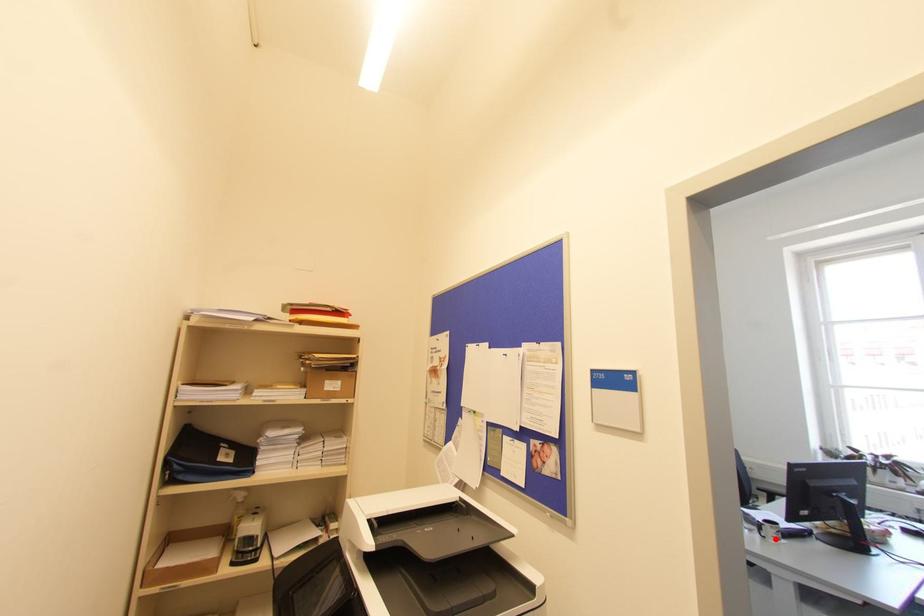
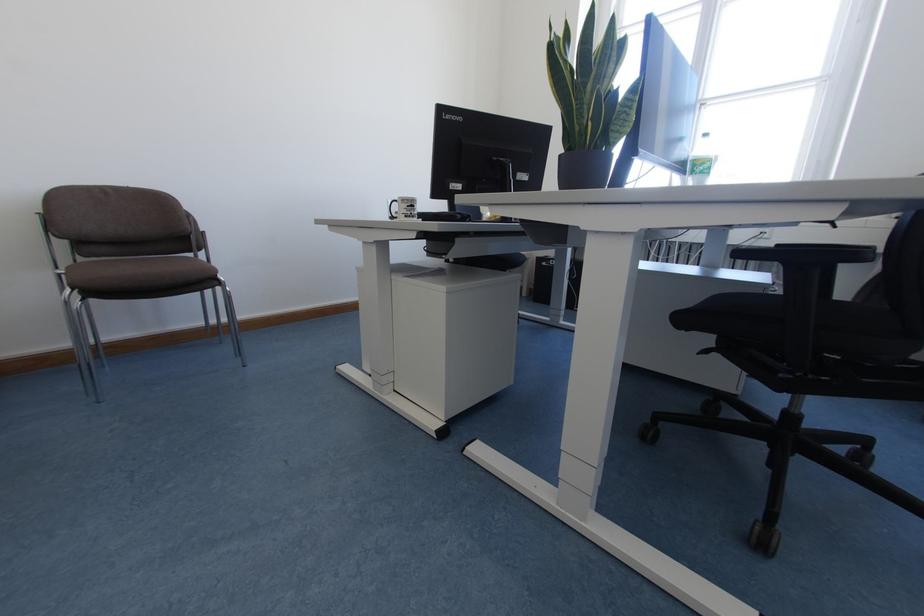
Where in the second image is the point corresponding to the highlighted location from the first image?

(405, 216)